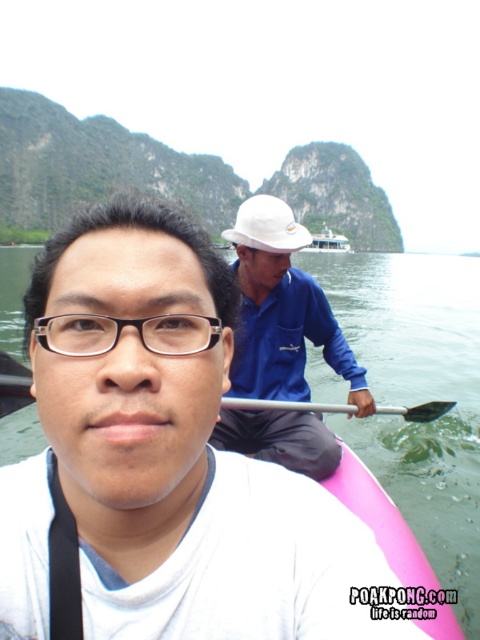
Question: Which object is the farthest from the silver metallic paddle at center?

Choices:
 (A) blue fabric shirt at center
 (B) matte white helmet at upper center

Answer: (B)

Question: Does matte white helmet at upper center appear on the right side of blue fabric shirt at center?

Choices:
 (A) no
 (B) yes

Answer: (A)

Question: Which point appears closest to the camera in this image?

Choices:
 (A) (238, 448)
 (B) (36, 513)

Answer: (B)

Question: Observing the image, what is the correct spatial positioning of matte white helmet at upper center in reference to blue fabric shirt at center?

Choices:
 (A) below
 (B) above

Answer: (A)

Question: From the image, what is the correct spatial relationship of matte white helmet at upper center in relation to silver metallic paddle at center?

Choices:
 (A) right
 (B) left

Answer: (B)

Question: Which point is farther from the camera taking this photo?

Choices:
 (A) (383, 518)
 (B) (2, 388)

Answer: (B)